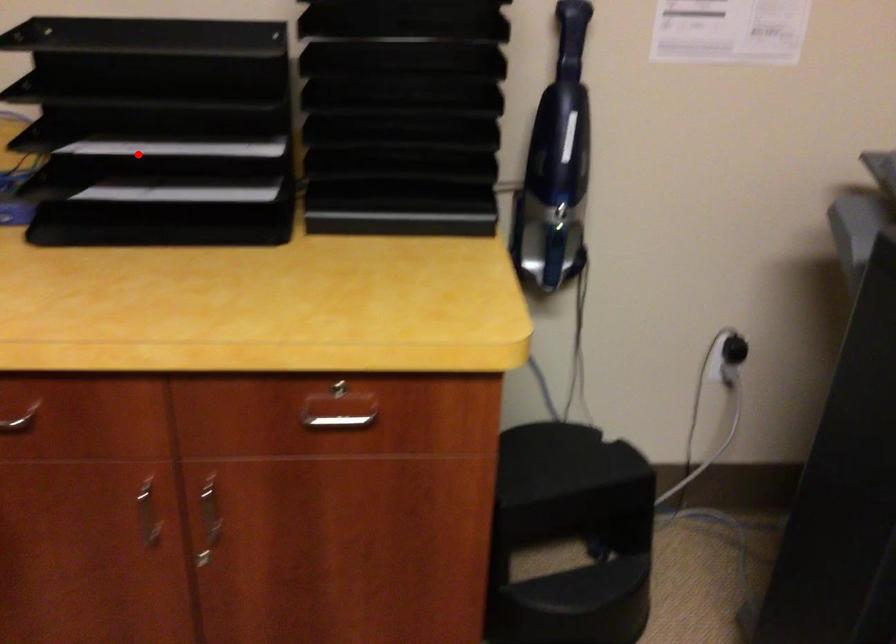
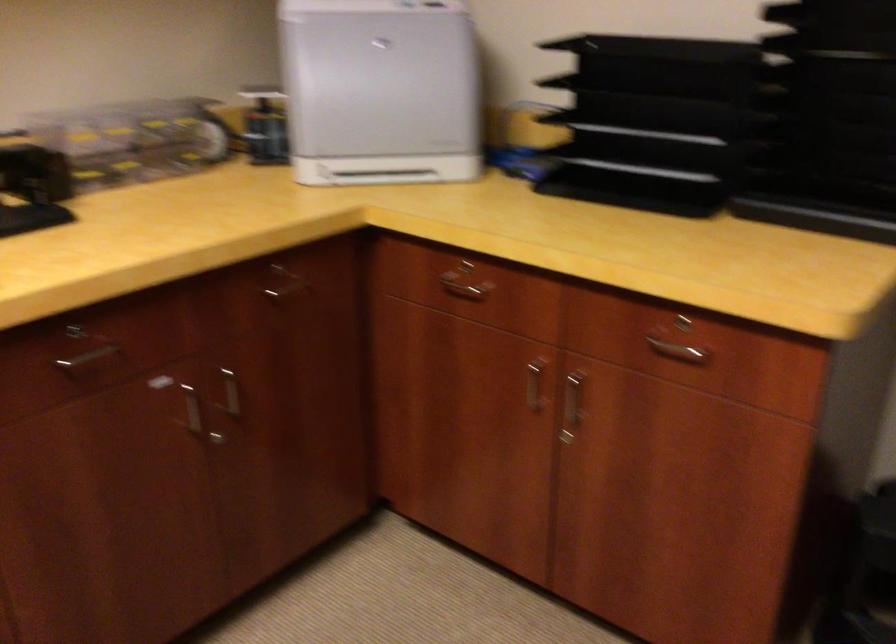
Where in the second image is the point corresponding to the highlighted location from the first image?

(633, 142)